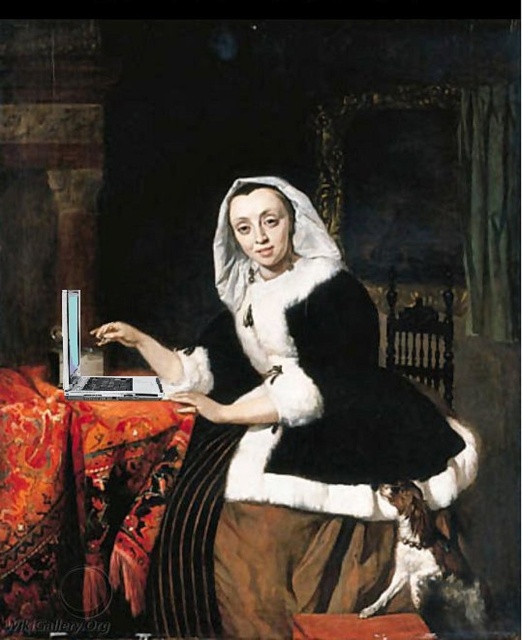
Does metallic silver laptop at left have a lesser height compared to silver metallic laptop at center?

No.

Which is behind, point (208, 468) or point (68, 372)?

The point (208, 468) is more distant.

The width and height of the screenshot is (522, 640). I want to click on metallic silver laptop at left, so tap(287, 433).

Who is lower down, silky red cloth at lower left or silver metallic laptop at center?

silky red cloth at lower left

Is silky red cloth at lower left to the left of silver metallic laptop at center from the viewer's perspective?

Indeed, silky red cloth at lower left is positioned on the left side of silver metallic laptop at center.

Is point (82, 429) positioned behind point (65, 296)?

No, it is in front of (65, 296).

Identify the location of silky red cloth at lower left. (77, 499).

Which is above, metallic silver laptop at left or silky red cloth at lower left?

metallic silver laptop at left is higher up.

Between metallic silver laptop at left and silky red cloth at lower left, which one appears on the left side from the viewer's perspective?

silky red cloth at lower left is more to the left.

Is point (384, 512) behind point (41, 516)?

That is False.

The width and height of the screenshot is (522, 640). What are the coordinates of `metallic silver laptop at left` in the screenshot? It's located at (287, 433).